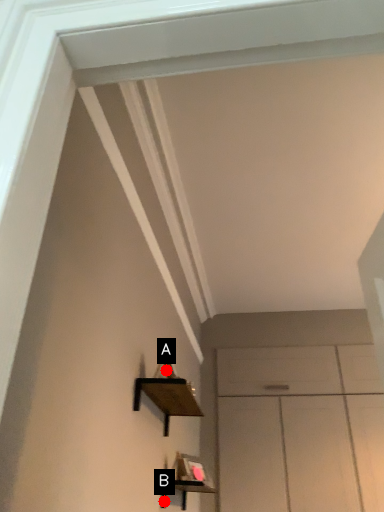
Question: Two points are circled on the image, labeled by A and B beside each circle. Which of the following is the farthest from the observer?

Choices:
 (A) A is further
 (B) B is further

Answer: (B)